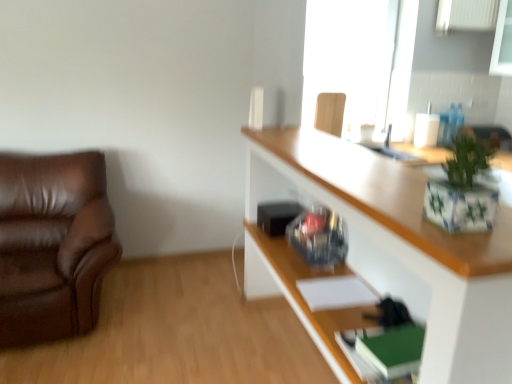
Question: From the image's perspective, is transparent glass window at upper center located above white glossy cabinet at upper right?

Choices:
 (A) no
 (B) yes

Answer: (B)

Question: Can you confirm if transparent glass window at upper center is shorter than white glossy cabinet at upper right?

Choices:
 (A) no
 (B) yes

Answer: (B)

Question: Can you confirm if transparent glass window at upper center is thinner than white glossy cabinet at upper right?

Choices:
 (A) no
 (B) yes

Answer: (B)

Question: From a real-world perspective, is transparent glass window at upper center physically below white glossy cabinet at upper right?

Choices:
 (A) no
 (B) yes

Answer: (A)

Question: Does transparent glass window at upper center have a greater width compared to white glossy cabinet at upper right?

Choices:
 (A) no
 (B) yes

Answer: (A)

Question: Would you say brown leather couch at left, the 1th chair when ordered from bottom to top, is to the left or to the right of white glossy cabinet at upper right in the picture?

Choices:
 (A) left
 (B) right

Answer: (A)

Question: Which is correct: brown leather couch at left, placed as the first chair when sorted from left to right, is inside white glossy cabinet at upper right, or outside of it?

Choices:
 (A) inside
 (B) outside

Answer: (B)

Question: From a real-world perspective, is brown leather couch at left, which is the 2th chair from top to bottom, physically located above or below white glossy cabinet at upper right?

Choices:
 (A) below
 (B) above

Answer: (A)

Question: In terms of width, does brown leather couch at left, which is the 2th chair from top to bottom, look wider or thinner when compared to white glossy cabinet at upper right?

Choices:
 (A) wide
 (B) thin

Answer: (A)

Question: From the image's perspective, relative to transparent glass window at upper center, is green ceramic pot at upper right above or below?

Choices:
 (A) above
 (B) below

Answer: (B)

Question: Is green ceramic pot at upper right spatially inside transparent glass window at upper center, or outside of it?

Choices:
 (A) outside
 (B) inside

Answer: (A)

Question: Considering their positions, is green ceramic pot at upper right located in front of or behind transparent glass window at upper center?

Choices:
 (A) behind
 (B) front

Answer: (B)

Question: Looking at the image, does green ceramic pot at upper right seem bigger or smaller compared to transparent glass window at upper center?

Choices:
 (A) big
 (B) small

Answer: (B)

Question: Is transparent glass window at upper center wider or thinner than wooden chair at upper right, the 1th chair positioned from the right?

Choices:
 (A) thin
 (B) wide

Answer: (B)

Question: From a real-world perspective, relative to wooden chair at upper right, which ranks as the 1th chair in top-to-bottom order, is transparent glass window at upper center vertically above or below?

Choices:
 (A) below
 (B) above

Answer: (B)